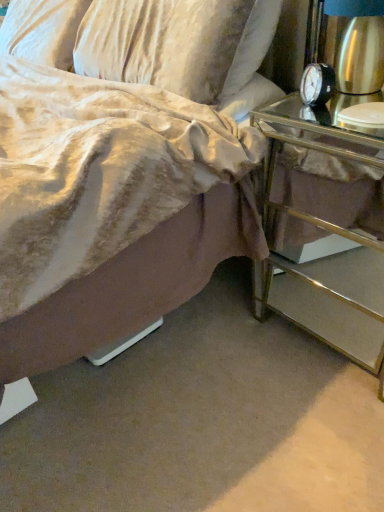
Based on the photo, what is the approximate height of black metal/aluminum alarm clock at upper right?

4.69 inches.

Describe the element at coordinates (317, 84) in the screenshot. I see `black metal/aluminum alarm clock at upper right` at that location.

Where is `black metal/aluminum alarm clock at upper right`? This screenshot has width=384, height=512. black metal/aluminum alarm clock at upper right is located at coordinates (317, 84).

The image size is (384, 512). What do you see at coordinates (326, 240) in the screenshot?
I see `metallic mirrored nightstand at right` at bounding box center [326, 240].

The width and height of the screenshot is (384, 512). I want to click on metallic mirrored nightstand at right, so pos(326,240).

Locate an element on the screen. black metal/aluminum alarm clock at upper right is located at coordinates click(x=317, y=84).

In the scene shown: Between black metal/aluminum alarm clock at upper right and metallic mirrored nightstand at right, which one appears on the left side from the viewer's perspective?

black metal/aluminum alarm clock at upper right is more to the left.

Is black metal/aluminum alarm clock at upper right behind metallic mirrored nightstand at right?

Yes, black metal/aluminum alarm clock at upper right is behind metallic mirrored nightstand at right.

Considering the points (307, 68) and (365, 321), which point is behind, point (307, 68) or point (365, 321)?

The point (365, 321) is behind.

From the image's perspective, is black metal/aluminum alarm clock at upper right on top of metallic mirrored nightstand at right?

Correct, black metal/aluminum alarm clock at upper right appears higher than metallic mirrored nightstand at right in the image.

From a real-world perspective, between black metal/aluminum alarm clock at upper right and metallic mirrored nightstand at right, who is vertically lower?

metallic mirrored nightstand at right.

Is black metal/aluminum alarm clock at upper right wider or thinner than metallic mirrored nightstand at right?

Clearly, black metal/aluminum alarm clock at upper right has less width compared to metallic mirrored nightstand at right.

Considering the relative sizes of black metal/aluminum alarm clock at upper right and metallic mirrored nightstand at right in the image provided, is black metal/aluminum alarm clock at upper right shorter than metallic mirrored nightstand at right?

Indeed, black metal/aluminum alarm clock at upper right has a lesser height compared to metallic mirrored nightstand at right.

Can you confirm if black metal/aluminum alarm clock at upper right is smaller than metallic mirrored nightstand at right?

Yes.

Is black metal/aluminum alarm clock at upper right inside the boundaries of metallic mirrored nightstand at right, or outside?

black metal/aluminum alarm clock at upper right is not inside metallic mirrored nightstand at right, it's outside.

Is black metal/aluminum alarm clock at upper right directly adjacent to metallic mirrored nightstand at right?

There is a gap between black metal/aluminum alarm clock at upper right and metallic mirrored nightstand at right.

From the picture: Is black metal/aluminum alarm clock at upper right aimed at metallic mirrored nightstand at right?

No, black metal/aluminum alarm clock at upper right is not facing towards metallic mirrored nightstand at right.

You are a GUI agent. You are given a task and a screenshot of the screen. Output one action in this format:
    pyautogui.click(x=<x>, y=<y>)
    Task: Click on the alarm clock above the metallic mirrored nightstand at right (from the image's perspective)
    
    Given the screenshot: What is the action you would take?
    pyautogui.click(x=317, y=84)

Is metallic mirrored nightstand at right to the right of black metal/aluminum alarm clock at upper right from the viewer's perspective?

Indeed, metallic mirrored nightstand at right is positioned on the right side of black metal/aluminum alarm clock at upper right.

Considering their positions, is metallic mirrored nightstand at right located in front of or behind black metal/aluminum alarm clock at upper right?

metallic mirrored nightstand at right is in front of black metal/aluminum alarm clock at upper right.

Is point (331, 329) positioned in front of point (320, 67)?

That is False.

From the image's perspective, is metallic mirrored nightstand at right positioned above or below black metal/aluminum alarm clock at upper right?

metallic mirrored nightstand at right is below black metal/aluminum alarm clock at upper right.

From a real-world perspective, is metallic mirrored nightstand at right physically located above or below black metal/aluminum alarm clock at upper right?

Clearly, from a real-world perspective, metallic mirrored nightstand at right is below black metal/aluminum alarm clock at upper right.

Considering the relative sizes of metallic mirrored nightstand at right and black metal/aluminum alarm clock at upper right in the image provided, is metallic mirrored nightstand at right wider than black metal/aluminum alarm clock at upper right?

Correct, the width of metallic mirrored nightstand at right exceeds that of black metal/aluminum alarm clock at upper right.

Can you confirm if metallic mirrored nightstand at right is taller than black metal/aluminum alarm clock at upper right?

Yes.

Which of these two, metallic mirrored nightstand at right or black metal/aluminum alarm clock at upper right, is bigger?

metallic mirrored nightstand at right is bigger.

Is metallic mirrored nightstand at right not within black metal/aluminum alarm clock at upper right?

Yes.

Is there a large distance between metallic mirrored nightstand at right and black metal/aluminum alarm clock at upper right?

They are positioned close to each other.

Is metallic mirrored nightstand at right oriented towards black metal/aluminum alarm clock at upper right?

No, metallic mirrored nightstand at right is not oriented towards black metal/aluminum alarm clock at upper right.

The image size is (384, 512). Identify the location of alarm clock above the metallic mirrored nightstand at right (from a real-world perspective). (317, 84).

This screenshot has height=512, width=384. Find the location of `nightstand that appears below the black metal/aluminum alarm clock at upper right (from the image's perspective)`. nightstand that appears below the black metal/aluminum alarm clock at upper right (from the image's perspective) is located at coordinates (326, 240).

This screenshot has height=512, width=384. Find the location of `alarm clock behind the metallic mirrored nightstand at right`. alarm clock behind the metallic mirrored nightstand at right is located at coordinates (317, 84).